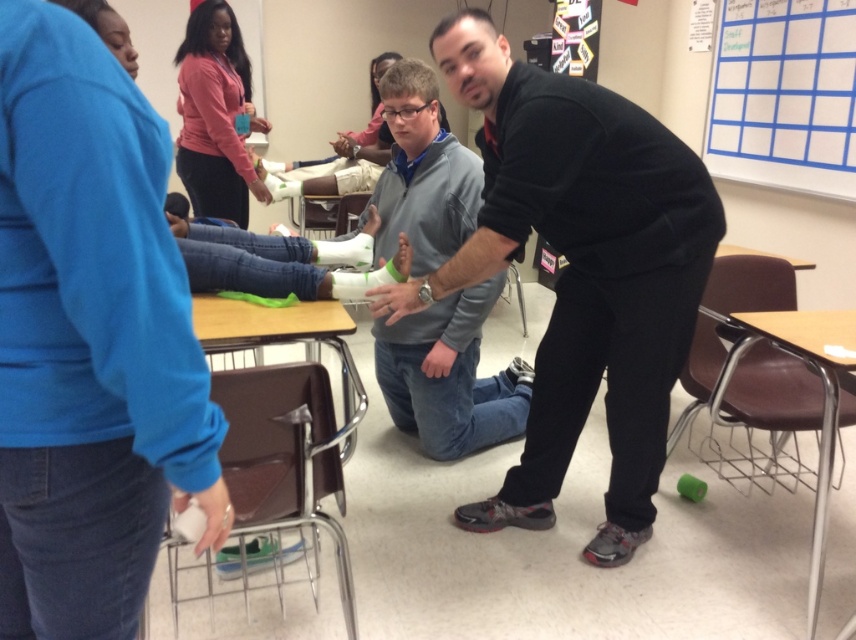
Question: Is black matte jacket at upper left to the left of pink fabric shirt at upper left from the viewer's perspective?

Choices:
 (A) yes
 (B) no

Answer: (B)

Question: Among these points, which one is nearest to the camera?

Choices:
 (A) (846, 170)
 (B) (474, 156)
 (C) (131, 170)
 (D) (812, 568)

Answer: (C)

Question: Which is farther from the white paperboard at upper right?

Choices:
 (A) black matte jacket at upper left
 (B) brown leather table at lower right

Answer: (A)

Question: Is gray fleece jacket at center wider than brown leather table at lower right?

Choices:
 (A) yes
 (B) no

Answer: (A)

Question: Which of the following is the farthest from the observer?

Choices:
 (A) black matte shirt at center
 (B) brown leather table at lower right
 (C) gray fleece jacket at center
 (D) pink fabric shirt at upper left

Answer: (D)

Question: Can you confirm if black matte jacket at upper left is positioned to the right of white paperboard at upper right?

Choices:
 (A) yes
 (B) no

Answer: (B)